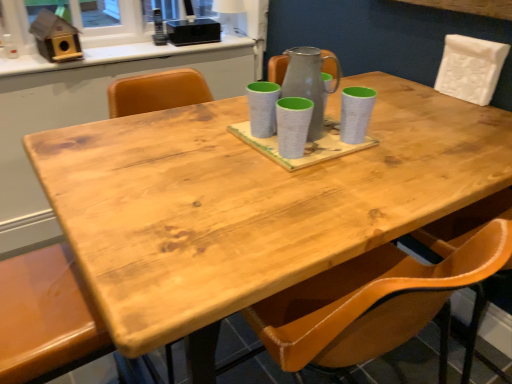
I want to click on matte gray pitcher at center, so pyautogui.click(x=309, y=83).

Consider the image. What is the approximate width of matte gray mug at center, marked as the third mug in a right-to-left arrangement?

The width of matte gray mug at center, marked as the third mug in a right-to-left arrangement, is 4.15 inches.

Locate an element on the screen. matte brown chair at lower left, which appears as the first chair when ordered from the bottom is located at coordinates (46, 317).

Where is `matte gray pitcher at center`? The width and height of the screenshot is (512, 384). matte gray pitcher at center is located at coordinates (309, 83).

Considering their positions, is speckled white mug at center, the second mug viewed from the left, located in front of or behind matte brown chair at lower left, which appears as the first chair when ordered from the bottom?

speckled white mug at center, the second mug viewed from the left, is behind matte brown chair at lower left, which appears as the first chair when ordered from the bottom.

From a real-world perspective, between speckled white mug at center, the second mug viewed from the left, and matte brown chair at lower left, marked as the 2th chair in a right-to-left arrangement, who is vertically higher?

speckled white mug at center, the second mug viewed from the left.

Is speckled white mug at center, the second mug viewed from the left, thinner than matte brown chair at lower left, which appears as the first chair when ordered from the bottom?

Yes, speckled white mug at center, the second mug viewed from the left, is thinner than matte brown chair at lower left, which appears as the first chair when ordered from the bottom.

Locate an element on the screen. Image resolution: width=512 pixels, height=384 pixels. chair below the speckled white mug at center, the 2th mug viewed from the right (from the image's perspective) is located at coordinates (46, 317).

From the image's perspective, which one is positioned lower, speckled white mug at center, the 2th mug viewed from the right, or matte gray mug at center, the first mug in the left-to-right sequence?

speckled white mug at center, the 2th mug viewed from the right, from the image's perspective.

Which of these two, speckled white mug at center, the 2th mug viewed from the right, or matte gray mug at center, the first mug in the left-to-right sequence, stands taller?

With more height is matte gray mug at center, the first mug in the left-to-right sequence.

Is point (309, 123) farther from camera compared to point (269, 99)?

No, it is in front of (269, 99).

Does speckled white mug at center, the 2th mug viewed from the right, appear on the left side of matte gray mug at center, marked as the third mug in a right-to-left arrangement?

No.

Considering the sizes of objects matte gray pitcher at center and speckled ceramic mug at center, acting as the third mug starting from the left, in the image provided, who is bigger, matte gray pitcher at center or speckled ceramic mug at center, acting as the third mug starting from the left,?

Bigger between the two is matte gray pitcher at center.

Would you say matte gray pitcher at center is outside speckled ceramic mug at center, arranged as the 1th mug when viewed from the right?

Yes, matte gray pitcher at center is located beyond the bounds of speckled ceramic mug at center, arranged as the 1th mug when viewed from the right.

Consider the image. Could you measure the distance between matte gray pitcher at center and speckled ceramic mug at center, acting as the third mug starting from the left?

3.83 inches.

Is matte gray pitcher at center positioned far away from speckled ceramic mug at center, acting as the third mug starting from the left?

No, matte gray pitcher at center is in close proximity to speckled ceramic mug at center, acting as the third mug starting from the left.

Which of these two, matte gray pitcher at center or white matte chair at upper right, arranged as the first chair when viewed from the right, is wider?

matte gray pitcher at center.

Which is less distant, (315, 80) or (467, 60)?

Point (315, 80) appears to be closer to the viewer than point (467, 60).

From the picture: Which object is positioned more to the right, matte gray pitcher at center or white matte chair at upper right, arranged as the first chair when viewed from the right?

white matte chair at upper right, arranged as the first chair when viewed from the right.

Looking at this image, is matte gray pitcher at center touching white matte chair at upper right, the 1th chair from the top?

They are not placed beside each other.

From the picture: Considering the positions of objects speckled ceramic mug at center, arranged as the 1th mug when viewed from the right, and matte gray mug at center, the first mug in the left-to-right sequence, in the image provided, who is behind, speckled ceramic mug at center, arranged as the 1th mug when viewed from the right, or matte gray mug at center, the first mug in the left-to-right sequence,?

matte gray mug at center, the first mug in the left-to-right sequence, is behind.

Which of these two, speckled ceramic mug at center, acting as the third mug starting from the left, or matte gray mug at center, the first mug in the left-to-right sequence, is thinner?

speckled ceramic mug at center, acting as the third mug starting from the left.

Would you say matte gray mug at center, the first mug in the left-to-right sequence, is part of speckled ceramic mug at center, arranged as the 1th mug when viewed from the right,'s contents?

Actually, matte gray mug at center, the first mug in the left-to-right sequence, is outside speckled ceramic mug at center, arranged as the 1th mug when viewed from the right.

Is white glossy counter top at upper center bigger or smaller than speckled white mug at center, the second mug viewed from the left?

white glossy counter top at upper center is bigger than speckled white mug at center, the second mug viewed from the left.

Does white glossy counter top at upper center come behind speckled white mug at center, the 2th mug viewed from the right?

Yes, white glossy counter top at upper center is behind speckled white mug at center, the 2th mug viewed from the right.

At what (x,y) coordinates should I click in order to perform the action: click on counter top behind the speckled white mug at center, the second mug viewed from the left. Please return your answer as a coordinate pair (x, y). This screenshot has height=384, width=512. Looking at the image, I should click on [115, 55].

Would you say white glossy counter top at upper center is inside or outside speckled white mug at center, the second mug viewed from the left?

The correct answer is: outside.

From a real-world perspective, does matte gray pitcher at center sit lower than matte gray mug at center, marked as the third mug in a right-to-left arrangement?

Incorrect, from a real-world perspective, matte gray pitcher at center is higher than matte gray mug at center, marked as the third mug in a right-to-left arrangement.

Considering the relative sizes of matte gray pitcher at center and matte gray mug at center, the first mug in the left-to-right sequence, in the image provided, is matte gray pitcher at center shorter than matte gray mug at center, the first mug in the left-to-right sequence,?

In fact, matte gray pitcher at center may be taller than matte gray mug at center, the first mug in the left-to-right sequence.

Does matte gray pitcher at center turn towards matte gray mug at center, the first mug in the left-to-right sequence?

Yes, matte gray pitcher at center is turned towards matte gray mug at center, the first mug in the left-to-right sequence.

Identify the location of the 2nd mug to the right when counting from the matte brown chair at lower left, the 2th chair viewed from the top. The image size is (512, 384). (293, 125).

From a real-world perspective, count 2nd mugs downward from the matte gray mug at center, the first mug in the left-to-right sequence, and point to it. Please provide its 2D coordinates.

[(293, 125)]

Estimate the real-world distances between objects in this image. Which object is closer to matte gray pitcher at center, speckled white mug at center, the second mug viewed from the left, or matte gray mug at center, marked as the third mug in a right-to-left arrangement?

The object closer to matte gray pitcher at center is matte gray mug at center, marked as the third mug in a right-to-left arrangement.

Looking at the image, which one is located further to matte brown chair at lower left, the 2th chair viewed from the top, white matte chair at upper right, which is the second chair in left-to-right order, or matte gray mug at center, marked as the third mug in a right-to-left arrangement?

white matte chair at upper right, which is the second chair in left-to-right order, lies further to matte brown chair at lower left, the 2th chair viewed from the top, than the other object.

When comparing their distances from white matte chair at upper right, arranged as the first chair when viewed from the right, does matte brown chair at lower left, which appears as the first chair when ordered from the bottom, or speckled ceramic mug at center, acting as the third mug starting from the left, seem further?

matte brown chair at lower left, which appears as the first chair when ordered from the bottom.

When comparing their distances from matte gray mug at center, the first mug in the left-to-right sequence, does white glossy counter top at upper center or white matte chair at upper right, arranged as the first chair when viewed from the right, seem further?

white glossy counter top at upper center lies further to matte gray mug at center, the first mug in the left-to-right sequence, than the other object.

Based on their spatial positions, is matte gray mug at center, the first mug in the left-to-right sequence, or speckled white mug at center, the second mug viewed from the left, further from matte gray pitcher at center?

Among the two, speckled white mug at center, the second mug viewed from the left, is located further to matte gray pitcher at center.

Based on their spatial positions, is matte gray mug at center, marked as the third mug in a right-to-left arrangement, or matte brown chair at lower left, the 2th chair viewed from the top, further from speckled white mug at center, the 2th mug viewed from the right?

The object further to speckled white mug at center, the 2th mug viewed from the right, is matte brown chair at lower left, the 2th chair viewed from the top.

Which object lies further to the anchor point white matte chair at upper right, the 1th chair from the top, speckled white mug at center, the second mug viewed from the left, or matte brown chair at lower left, which appears as the first chair when ordered from the bottom?

matte brown chair at lower left, which appears as the first chair when ordered from the bottom, is positioned further to the anchor white matte chair at upper right, the 1th chair from the top.

Based on their spatial positions, is speckled ceramic mug at center, acting as the third mug starting from the left, or matte gray mug at center, the first mug in the left-to-right sequence, closer to matte gray pitcher at center?

Based on the image, matte gray mug at center, the first mug in the left-to-right sequence, appears to be nearer to matte gray pitcher at center.

Image resolution: width=512 pixels, height=384 pixels. In order to click on chair between white glossy counter top at upper center and white matte chair at upper right, arranged as the first chair when viewed from the right, from left to right in this screenshot , I will do `click(46, 317)`.

Locate an element on the screen. glass vase situated between matte gray mug at center, the first mug in the left-to-right sequence, and speckled ceramic mug at center, acting as the third mug starting from the left, from left to right is located at coordinates pos(309,83).

At what (x,y) coordinates should I click in order to perform the action: click on glass vase between speckled white mug at center, the 2th mug viewed from the right, and white matte chair at upper right, which is the second chair in left-to-right order, from left to right. Please return your answer as a coordinate pair (x, y). Looking at the image, I should click on (309, 83).

You are a GUI agent. You are given a task and a screenshot of the screen. Output one action in this format:
    pyautogui.click(x=<x>, y=<y>)
    Task: Click on the glass vase positioned between speckled white mug at center, the second mug viewed from the left, and white glossy counter top at upper center from near to far
    
    Given the screenshot: What is the action you would take?
    pyautogui.click(x=309, y=83)